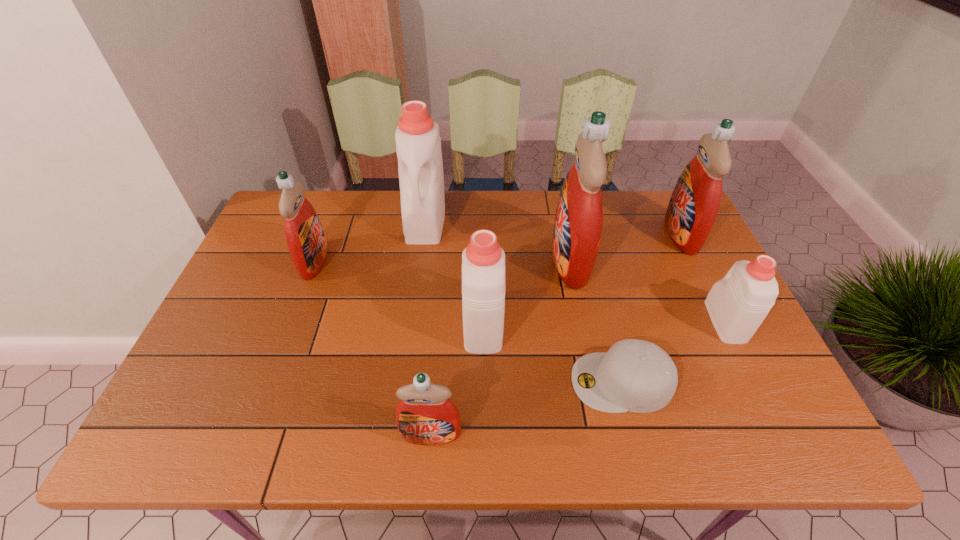
Where is `free point located 0.150m on the front surface of the leftmost red detergent`? This screenshot has height=540, width=960. free point located 0.150m on the front surface of the leftmost red detergent is located at coordinates (378, 261).

This screenshot has height=540, width=960. In order to click on blank space located on the handle side of the second biggest white detergent in this screenshot , I will do `click(483, 258)`.

This screenshot has width=960, height=540. I want to click on vacant area situated on the handle side of the second biggest white detergent, so click(x=483, y=273).

This screenshot has width=960, height=540. What are the coordinates of `free space located on the handle side of the second biggest white detergent` in the screenshot? It's located at (483, 242).

This screenshot has width=960, height=540. Find the location of `vacant space located on the handle side of the rightmost white detergent`. vacant space located on the handle side of the rightmost white detergent is located at coordinates (706, 280).

Where is `vacant space located 0.280m on the handle side of the rightmost white detergent`? This screenshot has height=540, width=960. vacant space located 0.280m on the handle side of the rightmost white detergent is located at coordinates (682, 232).

Image resolution: width=960 pixels, height=540 pixels. I want to click on free space located 0.170m on the handle side of the rightmost white detergent, so click(693, 256).

Locate an element on the screen. The height and width of the screenshot is (540, 960). vacant space located on the front-facing side of the cap is located at coordinates (437, 382).

Find the location of `free location located on the front-facing side of the cap`. free location located on the front-facing side of the cap is located at coordinates (416, 382).

Identify the location of vacant point located on the front-facing side of the cap. The width and height of the screenshot is (960, 540). (463, 382).